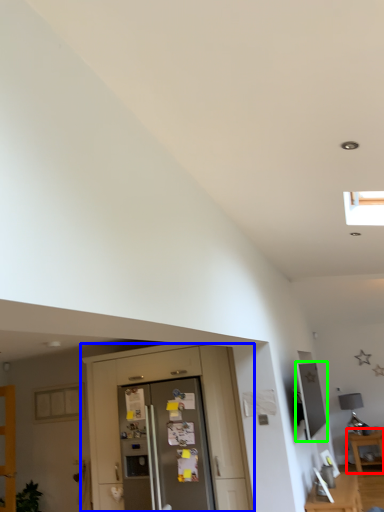
Question: Which object is positioned farthest from table (highlighted by a red box)? Select from dresser (highlighted by a blue box) and appliance (highlighted by a green box).

Choices:
 (A) dresser
 (B) appliance

Answer: (A)